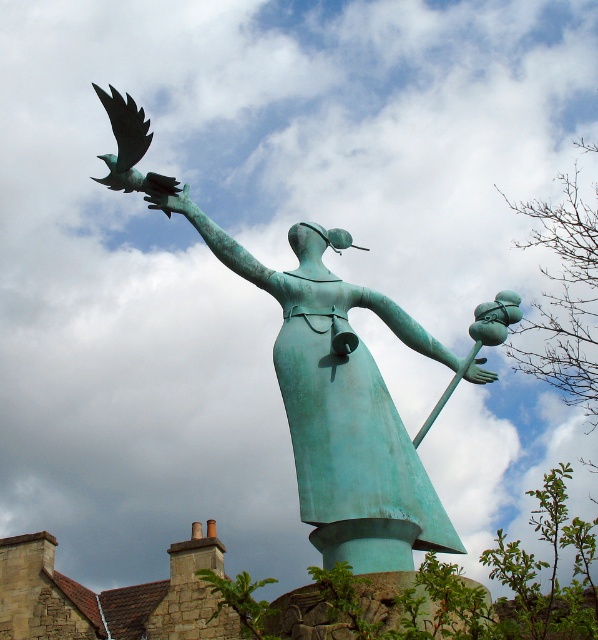
You are standing at the base of the bronze statue and want to place a small flower pot at point A and a decorative stone at point B. If point A is at coordinates point (x=343, y=282) and point B is at coordinates point (x=123, y=128), which point is closer to the statue?

Point B at coordinates point (x=123, y=128) is closer to the statue because point A is behind point B.